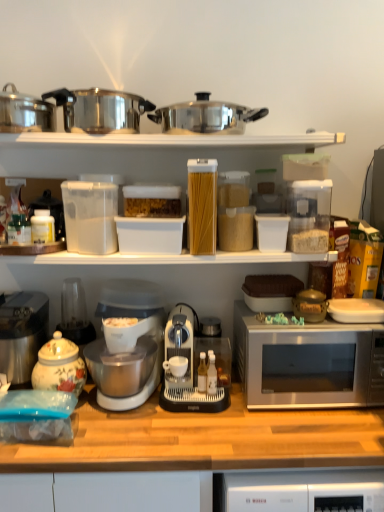
I want to click on free point in front of white plastic coffee machine at center, so click(x=199, y=431).